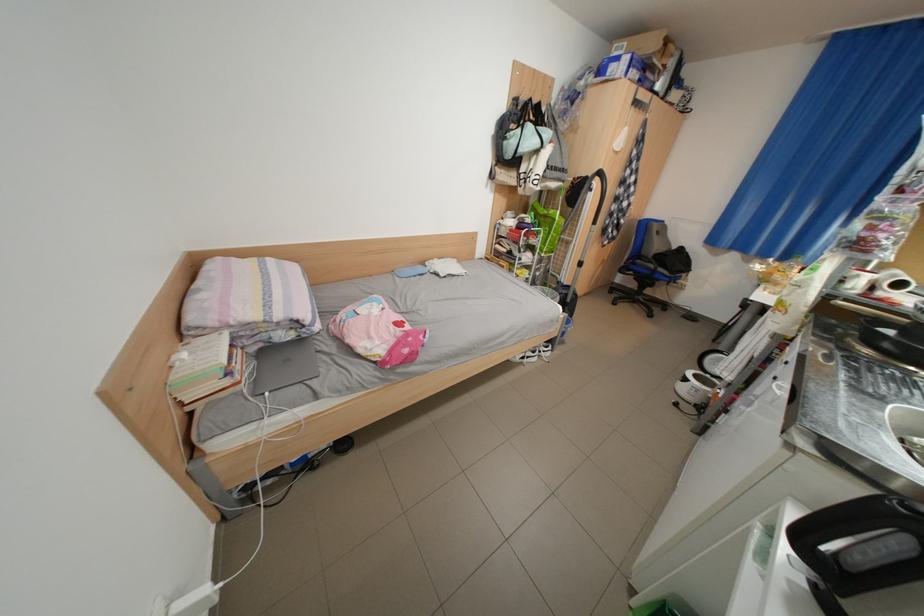
Find the location of a particular element. chair armrest is located at coordinates (640, 265).